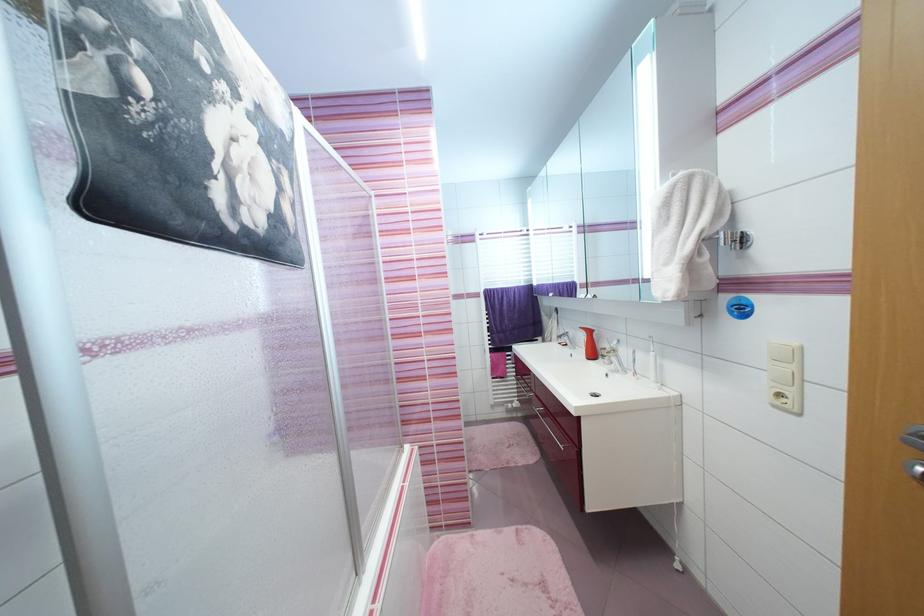
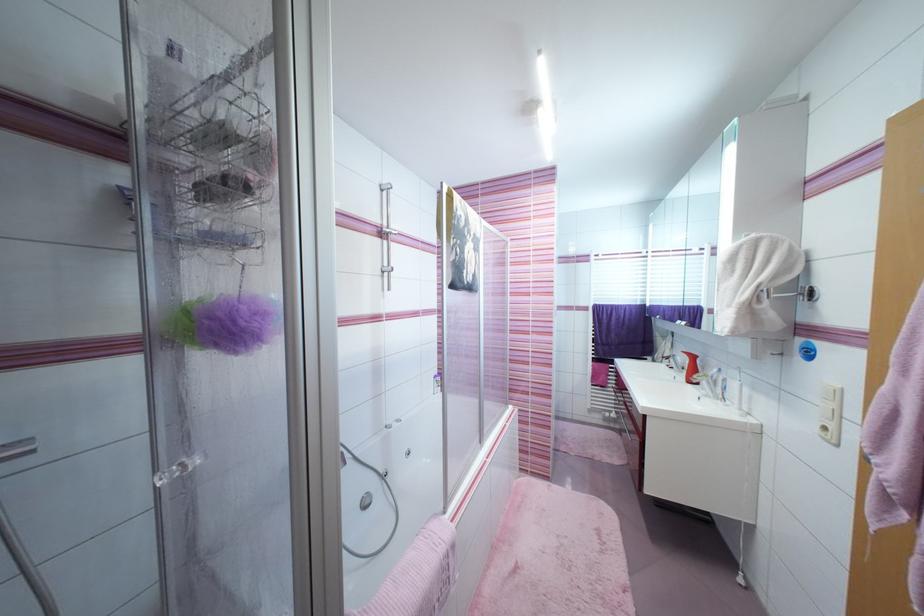
In the second image, find the point that corresponds to point 672,265 in the first image.

(735, 307)